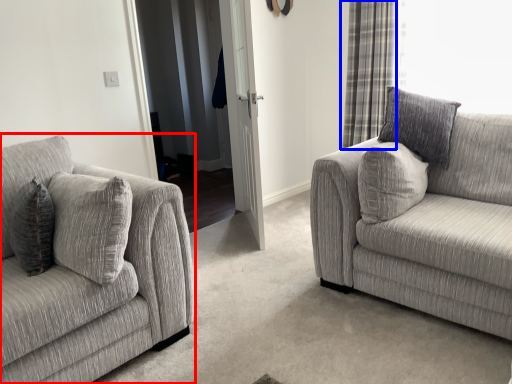
Question: Which object is further to the camera taking this photo, studio couch (highlighted by a red box) or curtain (highlighted by a blue box)?

Choices:
 (A) studio couch
 (B) curtain

Answer: (B)